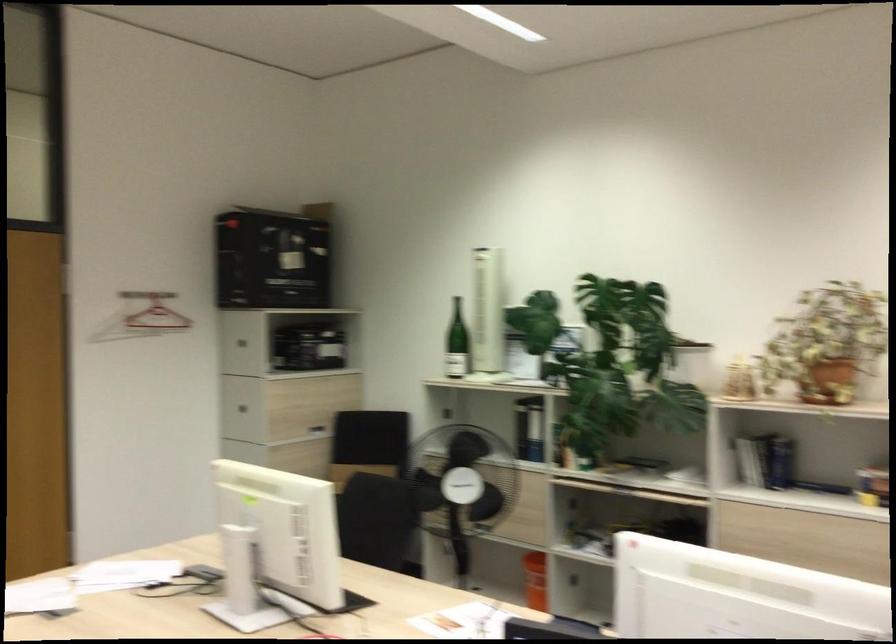
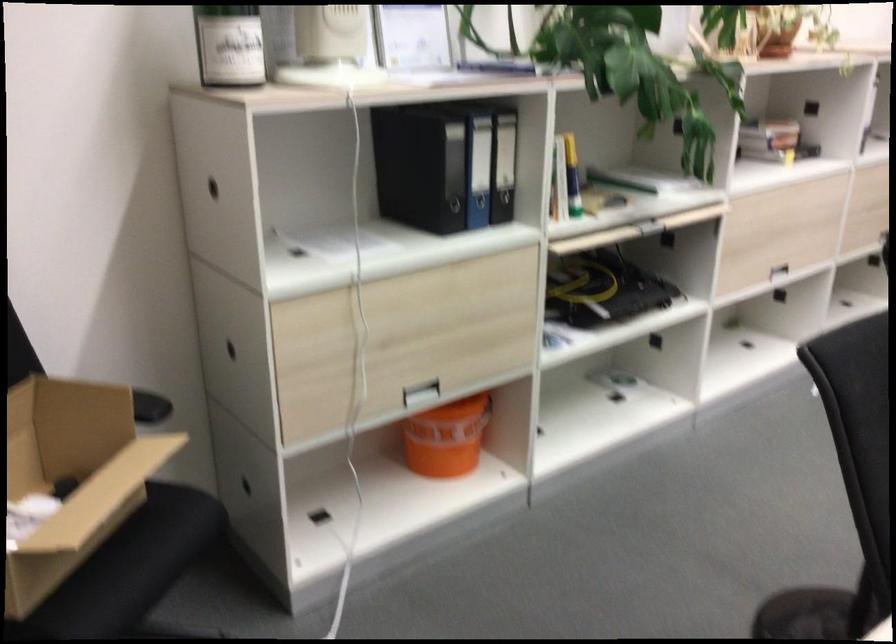
In the second image, find the point that corresponds to point 536,574 in the first image.

(446, 438)